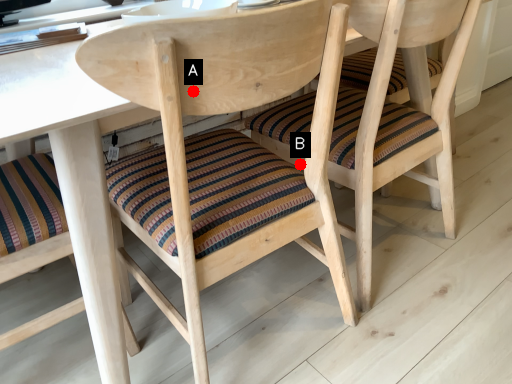
Question: Two points are circled on the image, labeled by A and B beside each circle. Which point appears closest to the camera in this image?

Choices:
 (A) A is closer
 (B) B is closer

Answer: (A)